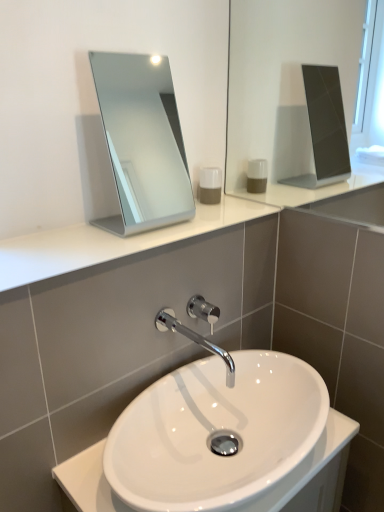
Question: Does silver metallic mirror at upper center have a lesser width compared to chrome/metallic faucet at center?

Choices:
 (A) yes
 (B) no

Answer: (A)

Question: Can you confirm if silver metallic mirror at upper center is positioned to the right of chrome/metallic faucet at center?

Choices:
 (A) yes
 (B) no

Answer: (B)

Question: Considering the relative positions of silver metallic mirror at upper center and chrome/metallic faucet at center in the image provided, is silver metallic mirror at upper center to the left of chrome/metallic faucet at center from the viewer's perspective?

Choices:
 (A) no
 (B) yes

Answer: (B)

Question: Is silver metallic mirror at upper center oriented away from chrome/metallic faucet at center?

Choices:
 (A) yes
 (B) no

Answer: (B)

Question: Can you confirm if silver metallic mirror at upper center is taller than chrome/metallic faucet at center?

Choices:
 (A) no
 (B) yes

Answer: (B)

Question: Would you say silver metallic mirror at upper center is a long distance from chrome/metallic faucet at center?

Choices:
 (A) no
 (B) yes

Answer: (B)

Question: Is white glossy sink at center at the left side of chrome/metallic faucet at center?

Choices:
 (A) yes
 (B) no

Answer: (B)

Question: Could chrome/metallic faucet at center be considered to be inside white glossy sink at center?

Choices:
 (A) yes
 (B) no

Answer: (B)

Question: From a real-world perspective, is white glossy sink at center below chrome/metallic faucet at center?

Choices:
 (A) no
 (B) yes

Answer: (B)

Question: Considering the relative sizes of white glossy sink at center and chrome/metallic faucet at center in the image provided, is white glossy sink at center shorter than chrome/metallic faucet at center?

Choices:
 (A) yes
 (B) no

Answer: (B)

Question: From the image's perspective, is white glossy sink at center on chrome/metallic faucet at center?

Choices:
 (A) yes
 (B) no

Answer: (B)

Question: Does white glossy sink at center turn towards chrome/metallic faucet at center?

Choices:
 (A) yes
 (B) no

Answer: (B)

Question: From a real-world perspective, is white glossy sink at center physically below translucent plastic soap dispenser at center?

Choices:
 (A) no
 (B) yes

Answer: (B)